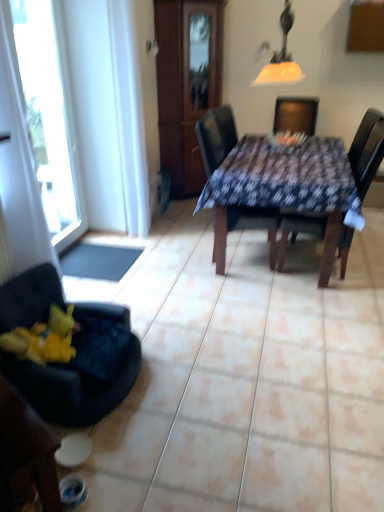
What do you see at coordinates (98, 261) in the screenshot?
I see `black rubber mat at lower left` at bounding box center [98, 261].

Image resolution: width=384 pixels, height=512 pixels. What do you see at coordinates (25, 454) in the screenshot?
I see `velvet dark blue chair at lower left, placed as the first chair when sorted from left to right` at bounding box center [25, 454].

In order to face dark blue fabric-covered table at center, should I rotate leftwards or rightwards?

It's best to rotate right around 11.412 degrees.

In order to face dark brown wooden chair at center, positioned as the 4th chair in left-to-right order, should I rotate leftwards or rightwards?

You should look right and rotate roughly 17.833 degrees.

Locate an element on the screen. black rubber mat at lower left is located at coordinates (98, 261).

Is the depth of dark blue fabric-covered table at center greater than that of dark brown wooden chair at center, positioned as the 4th chair in left-to-right order?

No.

Considering the relative sizes of dark blue fabric-covered table at center and dark brown wooden chair at center, the first chair viewed from the right, in the image provided, is dark blue fabric-covered table at center thinner than dark brown wooden chair at center, the first chair viewed from the right,?

In fact, dark blue fabric-covered table at center might be wider than dark brown wooden chair at center, the first chair viewed from the right.

Based on the photo, considering the relative sizes of dark blue fabric-covered table at center and dark brown wooden chair at center, the first chair viewed from the right, in the image provided, is dark blue fabric-covered table at center bigger than dark brown wooden chair at center, the first chair viewed from the right,?

Correct, dark blue fabric-covered table at center is larger in size than dark brown wooden chair at center, the first chair viewed from the right.

Is point (247, 178) in front of point (382, 128)?

No, it is not.

Is yellow plush toy at lower left beside velvet black chair at lower left, the second chair from the left?

yellow plush toy at lower left is not next to velvet black chair at lower left, the second chair from the left, and they're not touching.

Consider the image. Does yellow plush toy at lower left turn towards velvet black chair at lower left, the third chair positioned from the right?

Yes, yellow plush toy at lower left faces towards velvet black chair at lower left, the third chair positioned from the right.

Can you tell me how much yellow plush toy at lower left and velvet black chair at lower left, the second chair from the left, differ in facing direction?

There is a 10.2-degree angle between the facing directions of yellow plush toy at lower left and velvet black chair at lower left, the second chair from the left.

Consider the image. Which is nearer, [64,341] or [126,310]?

Point [64,341].

Is transparent glass window at left positioned far away from dark blue fabric-covered table at center?

Yes, transparent glass window at left and dark blue fabric-covered table at center are quite far apart.

Who is taller, transparent glass window at left or dark blue fabric-covered table at center?

transparent glass window at left is taller.

From the image's perspective, which is above, transparent glass window at left or dark blue fabric-covered table at center?

transparent glass window at left appears higher in the image.

Measure the distance between dark blue fabric-covered table at center and velvet black chair at lower left, the second chair from the left.

dark blue fabric-covered table at center and velvet black chair at lower left, the second chair from the left, are 1.39 meters apart from each other.

Which object is wider, dark blue fabric-covered table at center or velvet black chair at lower left, the third chair positioned from the right?

dark blue fabric-covered table at center is wider.

Are dark blue fabric-covered table at center and velvet black chair at lower left, the second chair from the left, making contact?

No, dark blue fabric-covered table at center is not beside velvet black chair at lower left, the second chair from the left.

Is dark blue fabric-covered table at center looking in the opposite direction of velvet black chair at lower left, the second chair from the left?

No, dark blue fabric-covered table at center is not facing the opposite direction of velvet black chair at lower left, the second chair from the left.

At what (x,y) coordinates should I click in order to perform the action: click on lamp lying above the black rubber mat at lower left (from the image's perspective). Please return your answer as a coordinate pair (x, y). This screenshot has height=512, width=384. Looking at the image, I should click on (281, 57).

Measure the distance from black rubber mat at lower left to matte yellow glass lampshade at upper center.

1.74 meters.

Does black rubber mat at lower left contain matte yellow glass lampshade at upper center?

No.

Which object is closer to the camera taking this photo, black rubber mat at lower left or matte yellow glass lampshade at upper center?

matte yellow glass lampshade at upper center is more forward.

Where is `kitchen & dining room table in front of the black rubber mat at lower left`? The width and height of the screenshot is (384, 512). kitchen & dining room table in front of the black rubber mat at lower left is located at coordinates (284, 187).

Considering the sizes of objects dark blue fabric-covered table at center and black rubber mat at lower left in the image provided, who is smaller, dark blue fabric-covered table at center or black rubber mat at lower left?

Smaller between the two is black rubber mat at lower left.

Could you tell me if dark blue fabric-covered table at center is facing black rubber mat at lower left?

No, dark blue fabric-covered table at center is not facing towards black rubber mat at lower left.

Between point (294, 201) and point (121, 276), which one is positioned behind?

Positioned behind is point (121, 276).

From the image's perspective, is matte yellow glass lampshade at upper center positioned above or below transparent glass window at left?

Clearly, from the image's perspective, matte yellow glass lampshade at upper center is above transparent glass window at left.

Is matte yellow glass lampshade at upper center not close to transparent glass window at left?

That's right, there is a large distance between matte yellow glass lampshade at upper center and transparent glass window at left.

Considering the relative sizes of matte yellow glass lampshade at upper center and transparent glass window at left in the image provided, is matte yellow glass lampshade at upper center wider than transparent glass window at left?

Correct, the width of matte yellow glass lampshade at upper center exceeds that of transparent glass window at left.

Between matte yellow glass lampshade at upper center and transparent glass window at left, which one has less height?

matte yellow glass lampshade at upper center.

Find the location of `chair on the right of the dark blue fabric-covered table at center`. chair on the right of the dark blue fabric-covered table at center is located at coordinates (367, 150).

Locate an element on the screen. The image size is (384, 512). toy located below the velvet black chair at lower left, the second chair from the left (from the image's perspective) is located at coordinates (44, 338).

Estimate the real-world distances between objects in this image. Which object is closer to wooden armoire at center, dark brown wooden chair at center, positioned as the 4th chair in left-to-right order, or dark blue fabric-covered table at center?

Based on the image, dark blue fabric-covered table at center appears to be nearer to wooden armoire at center.

Looking at the image, which one is located closer to dark brown wooden chair at center, the first chair viewed from the right, transparent glass window at left or wooden armoire at center?

wooden armoire at center lies closer to dark brown wooden chair at center, the first chair viewed from the right, than the other object.

When comparing their distances from dark blue fabric chair at center, which appears as the 2th chair when viewed from the right, does wooden armoire at center or matte yellow glass lampshade at upper center seem further?

wooden armoire at center is further to dark blue fabric chair at center, which appears as the 2th chair when viewed from the right.

Based on their spatial positions, is dark brown wooden chair at center, the first chair viewed from the right, or dark blue fabric-covered table at center closer to black rubber mat at lower left?

dark blue fabric-covered table at center lies closer to black rubber mat at lower left than the other object.

Estimate the real-world distances between objects in this image. Which object is further from matte yellow glass lampshade at upper center, dark brown wooden chair at center, the first chair viewed from the right, or dark blue fabric-covered table at center?

The object further to matte yellow glass lampshade at upper center is dark brown wooden chair at center, the first chair viewed from the right.

When comparing their distances from velvet black chair at lower left, the second chair from the left, does dark blue fabric-covered table at center or velvet dark blue chair at lower left, placed as the first chair when sorted from left to right, seem closer?

velvet dark blue chair at lower left, placed as the first chair when sorted from left to right, is positioned closer to the anchor velvet black chair at lower left, the second chair from the left.

Based on their spatial positions, is velvet dark blue chair at lower left, placed as the first chair when sorted from left to right, or black rubber mat at lower left closer to transparent glass window at left?

black rubber mat at lower left is closer to transparent glass window at left.

Which object lies further to the anchor point yellow plush toy at lower left, transparent glass window at left or velvet black chair at lower left, the third chair positioned from the right?

Among the two, transparent glass window at left is located further to yellow plush toy at lower left.

This screenshot has height=512, width=384. I want to click on window between velvet dark blue chair at lower left, placed as the first chair when sorted from left to right, and black rubber mat at lower left in the front-back direction, so click(x=48, y=112).

The width and height of the screenshot is (384, 512). Find the location of `armoire between black rubber mat at lower left and dark brown wooden chair at center, positioned as the 4th chair in left-to-right order, from left to right`. armoire between black rubber mat at lower left and dark brown wooden chair at center, positioned as the 4th chair in left-to-right order, from left to right is located at coordinates (186, 84).

Locate an element on the screen. This screenshot has width=384, height=512. lamp between wooden armoire at center and yellow plush toy at lower left from top to bottom is located at coordinates coord(281,57).

Where is `flat between velvet dark blue chair at lower left, placed as the first chair when sorted from left to right, and wooden armoire at center in the front-back direction`? The width and height of the screenshot is (384, 512). flat between velvet dark blue chair at lower left, placed as the first chair when sorted from left to right, and wooden armoire at center in the front-back direction is located at coordinates (98, 261).